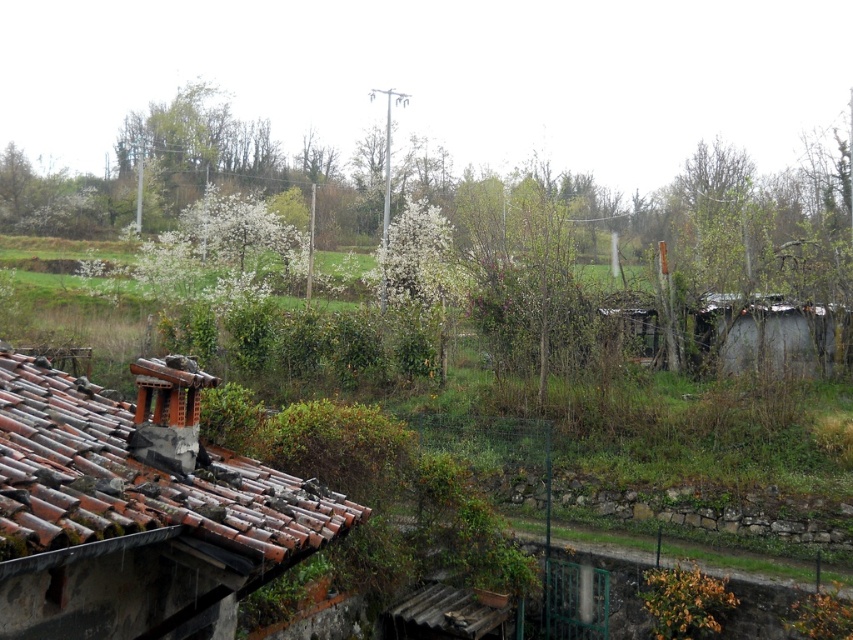
Between rusty clay roof tiles at lower left and rusty corrugated metal hut at right, which one appears on the right side from the viewer's perspective?

Positioned to the right is rusty corrugated metal hut at right.

Can you confirm if rusty clay roof tiles at lower left is wider than rusty corrugated metal hut at right?

Indeed, rusty clay roof tiles at lower left has a greater width compared to rusty corrugated metal hut at right.

Is point (161, 368) positioned after point (805, 342)?

That is False.

I want to click on rusty clay roof tiles at lower left, so click(136, 509).